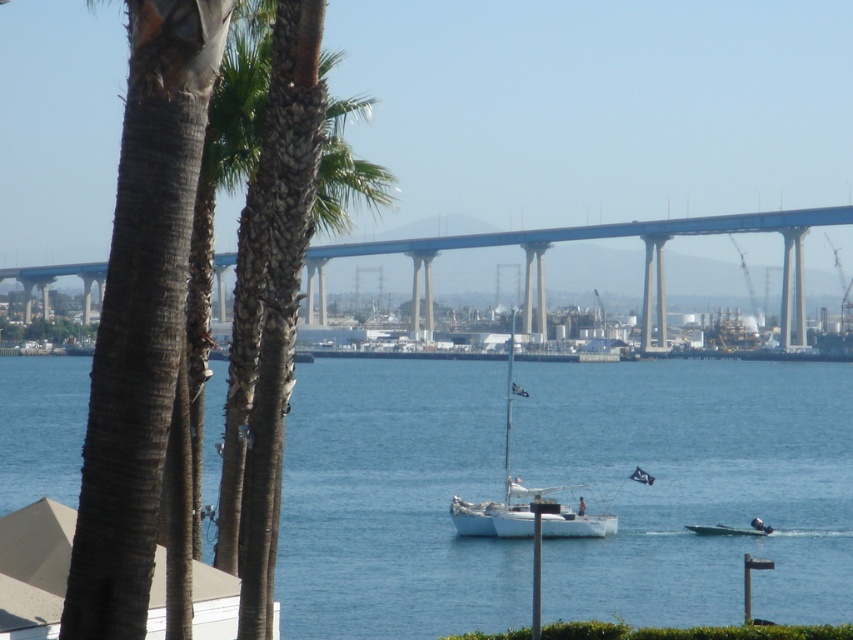
How far apart are blue water at center and white matte sailboat at center?

A distance of 70.30 feet exists between blue water at center and white matte sailboat at center.

Is blue water at center bigger than white matte sailboat at center?

Yes, blue water at center is bigger than white matte sailboat at center.

This screenshot has height=640, width=853. What do you see at coordinates (694, 486) in the screenshot? I see `blue water at center` at bounding box center [694, 486].

The image size is (853, 640). I want to click on blue water at center, so click(x=694, y=486).

Between blue water at center and blue concrete bridge at center, which one has more height?

blue concrete bridge at center is taller.

Does point (498, 433) come in front of point (35, 272)?

Yes, point (498, 433) is in front of point (35, 272).

Locate an element on the screen. blue water at center is located at coordinates (x=694, y=486).

Who is shorter, blue concrete bridge at center or white matte sailboat at center?

Standing shorter between the two is white matte sailboat at center.

Is point (537, 243) positioned in front of point (526, 524)?

No.

Is point (660, 221) positioned in front of point (489, 515)?

That is False.

Where is `blue concrete bridge at center`? This screenshot has height=640, width=853. blue concrete bridge at center is located at coordinates (602, 237).